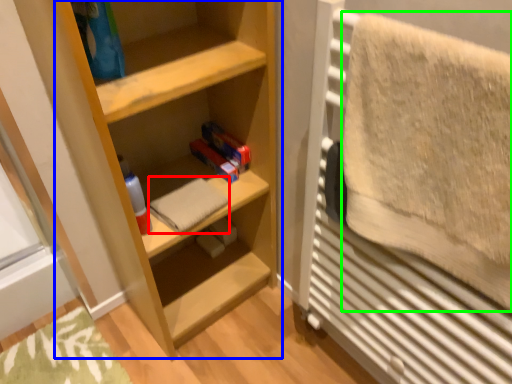
Question: Which is farther away from bath towel (highlighted by a red box)? shelf (highlighted by a blue box) or bath towel (highlighted by a green box)?

Choices:
 (A) shelf
 (B) bath towel

Answer: (B)